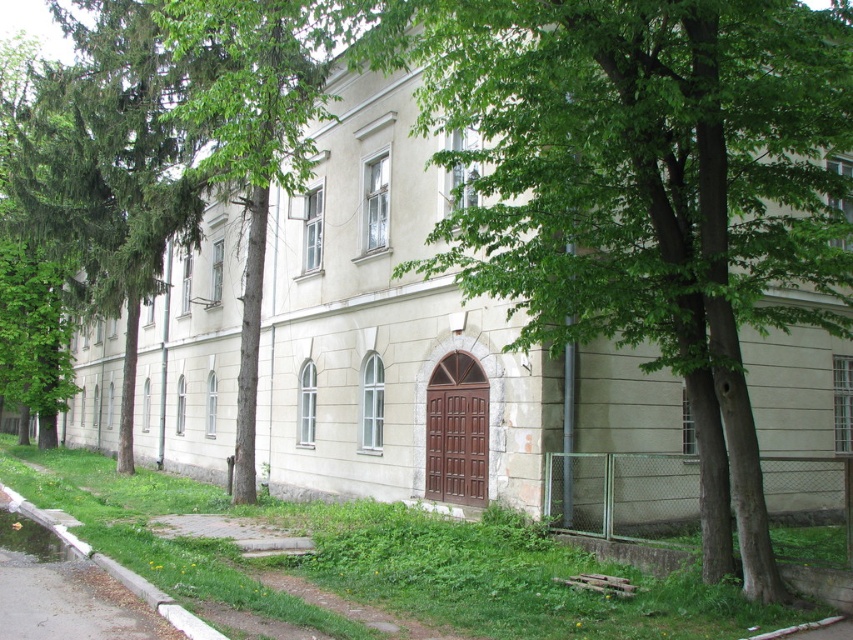
From the picture: You are standing on the gray concrete sidewalk at lower left and looking towards the green leafy tree at center. Which direction should you walk to reach the tree?

The green leafy tree at center is located above the gray concrete sidewalk at lower left, so you should walk forward to reach the tree.

You are standing at a point where you can see the entire building. You want to place a new bench exactly 7 meters away from your current position. Is the point at coordinates point (563,205) within the area where the bench can be placed?

The distance between point (563,205) and the camera is 7.53 meters. Since the desired bench placement is 7 meters away, the point is slightly beyond the required distance. Therefore, the bench cannot be placed at point (563,205).

From the picture: You are a delivery person approaching the building and need to park your vehicle. The gray concrete sidewalk at lower left and the white concrete curb at lower left are in your path. Which one should you avoid driving over to park near the arched doorway?

You should avoid driving over the gray concrete sidewalk at lower left because the white concrete curb at lower left is behind it, meaning the sidewalk is closer to the road and the curb is at the edge. Parking near the arched doorway would require staying on the curb side without crossing onto the sidewalk.